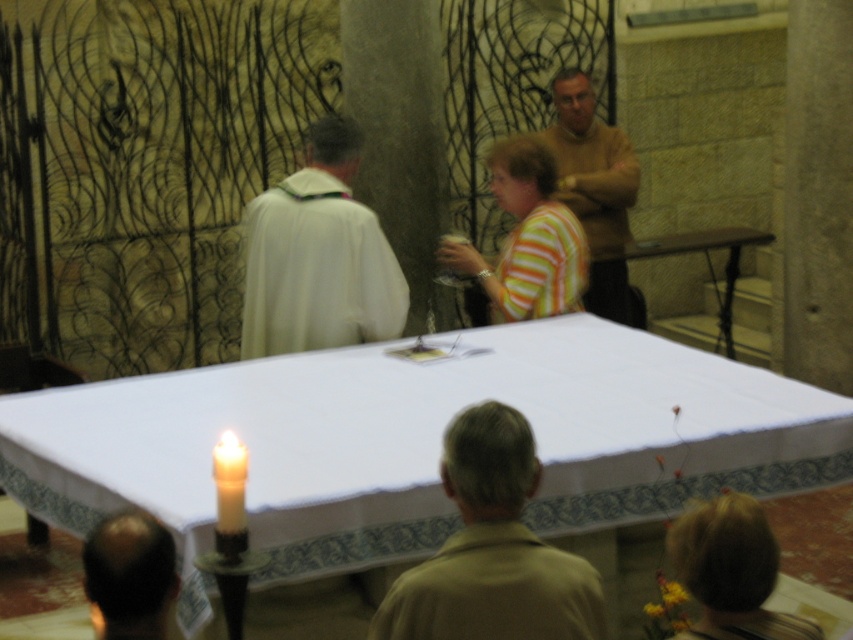
You are an observer in the church scene. You notice the striped fabric shirt at center and the bald head at lower left. Which object takes up more visual space in the image?

The striped fabric shirt at center has a larger size compared to the bald head at lower left, so it takes up more visual space.

You are an interior designer planning to place a decorative vase between the white cloth table at center and the light beige fabric at center. Based on their widths, which object should the vase be closer to?

The white cloth table at center is wider than the light beige fabric at center, so the vase should be placed closer to the light beige fabric at center to balance the widths.

In the religious setting, you see a striped fabric shirt at center and a bald head at lower left. Which object is positioned to the right of the other?

The striped fabric shirt at center is to the right of bald head at lower left.